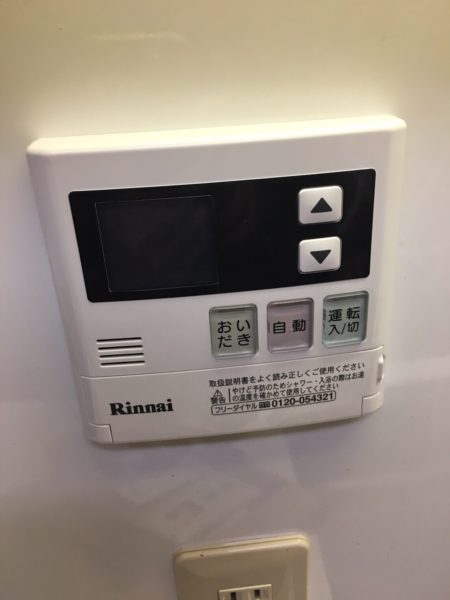
This screenshot has width=450, height=600. Find the location of `outlet`. outlet is located at coordinates (253, 563).